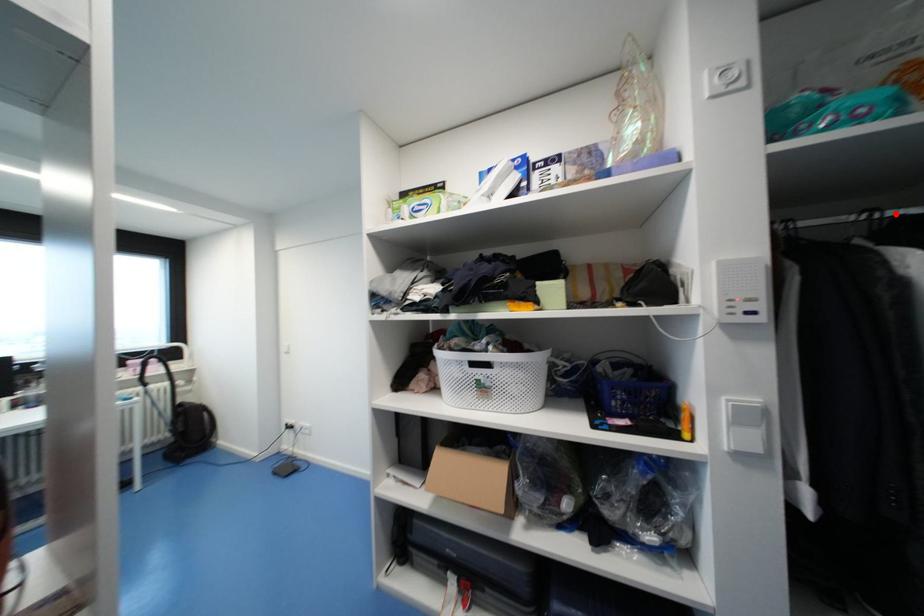
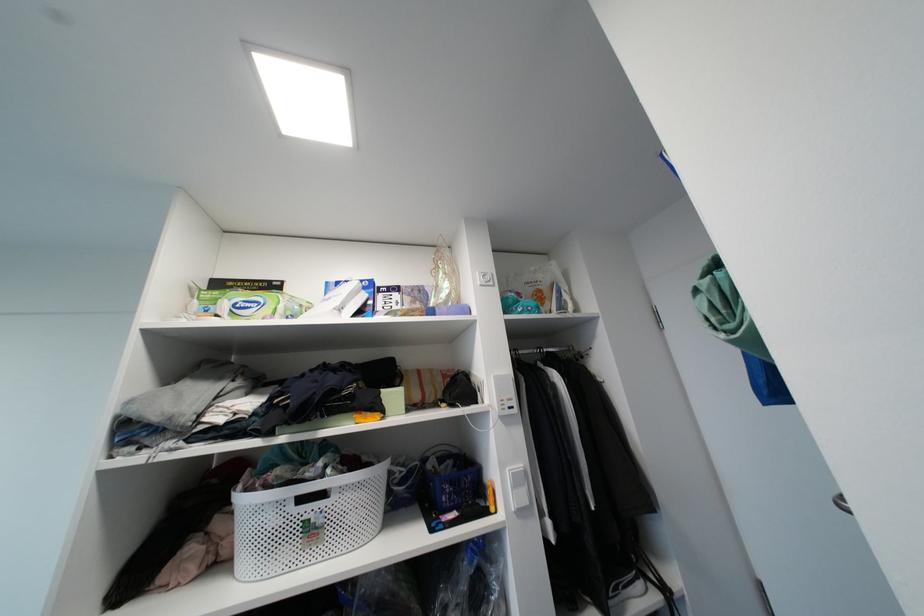
Locate, in the second image, the point that corresponds to the highlighted location in the first image.

(550, 351)